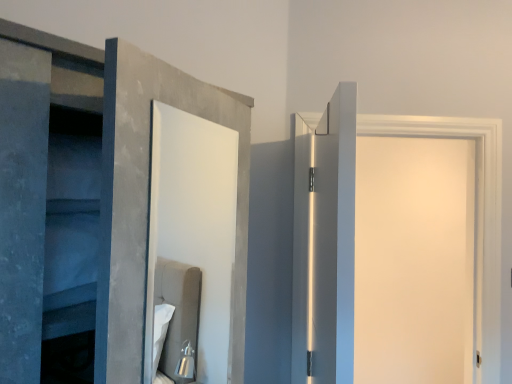
The height and width of the screenshot is (384, 512). Find the location of `empty space that is ontop of white matte door at right, which ranks as the first door in back-to-front order (from a real-world perspective)`. empty space that is ontop of white matte door at right, which ranks as the first door in back-to-front order (from a real-world perspective) is located at coordinates (425, 114).